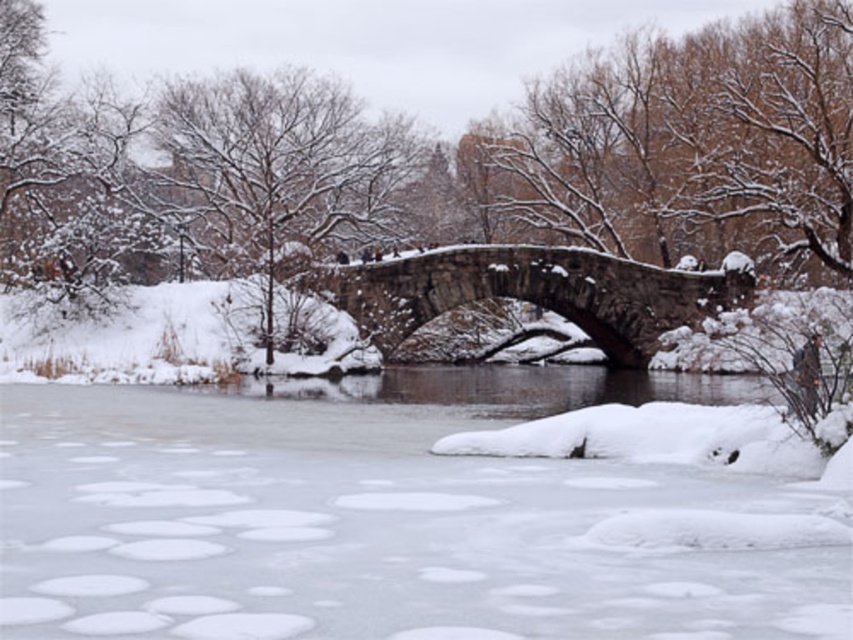
You are standing at point (610, 353) and want to walk to the stone bridge. Which direction should you move relative to point (230, 92)?

Since point (230, 92) is behind point (610, 353), you should move in the direction away from point (230, 92) to reach the stone bridge.

You are standing on the stone bridge and want to cross to the other side. There is a point marked at coordinates (378, 518). What is the condition of the surface at that point?

The point at coordinates (378, 518) marks transparent ice at center, which suggests it is safe to walk on since transparent ice is typically stronger and more stable than slushy or opaque ice.